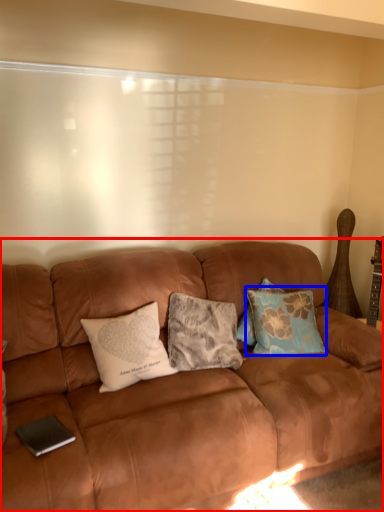
Question: Among these objects, which one is farthest to the camera, studio couch (highlighted by a red box) or pillow (highlighted by a blue box)?

Choices:
 (A) studio couch
 (B) pillow

Answer: (B)